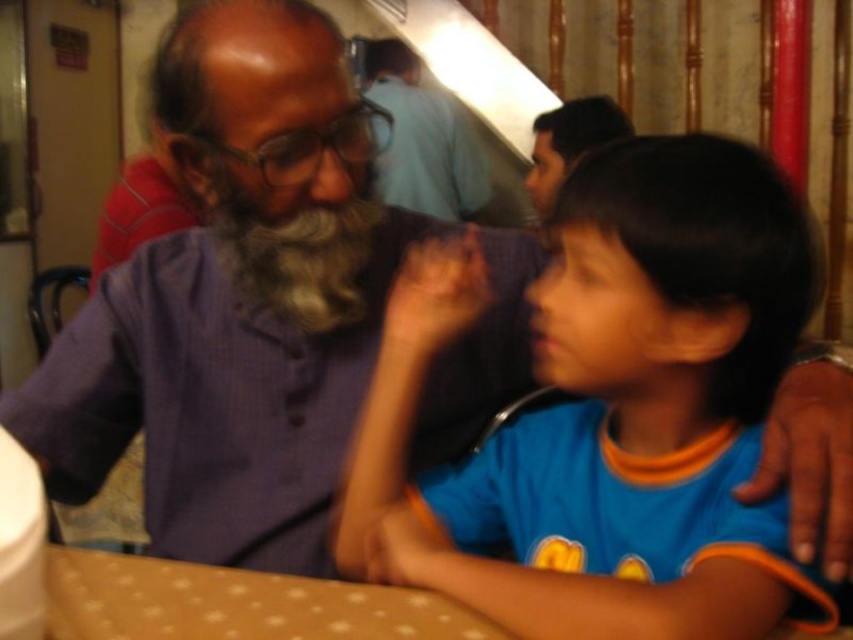
Is point (173, 596) positioned in front of point (444, 189)?

Yes, point (173, 596) is closer to viewer.

Who is higher up, brown fabric table at lower center or matte purple shirt at center?

matte purple shirt at center

Is point (341, 582) positioned behind point (428, 99)?

No, (341, 582) is in front of (428, 99).

In order to click on brown fabric table at lower center in this screenshot , I will do `click(234, 604)`.

Which is in front, point (772, 195) or point (466, 179)?

Point (772, 195)

Locate an element on the screen. blue cotton shirt at center is located at coordinates (608, 410).

Which is in front, point (727, 152) or point (395, 170)?

Positioned in front is point (727, 152).

Image resolution: width=853 pixels, height=640 pixels. I want to click on blue cotton shirt at center, so click(x=608, y=410).

Can you confirm if graywoollybeard at center is shorter than matte purple shirt at center?

Yes, graywoollybeard at center is shorter than matte purple shirt at center.

How far apart are graywoollybeard at center and matte purple shirt at center?

graywoollybeard at center is 1.67 meters from matte purple shirt at center.

Locate an element on the screen. The height and width of the screenshot is (640, 853). graywoollybeard at center is located at coordinates (294, 253).